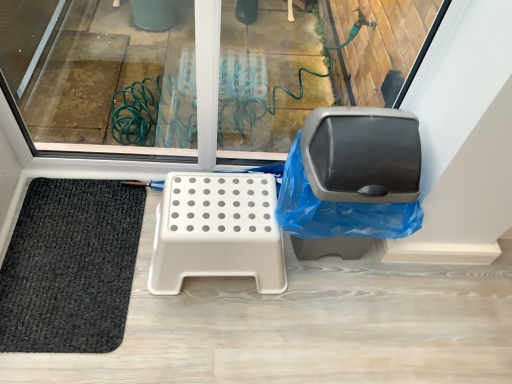
Locate an element on the screen. vacant space that is in between matte gray swivel chair at right and beige plastic step stool at center is located at coordinates (317, 281).